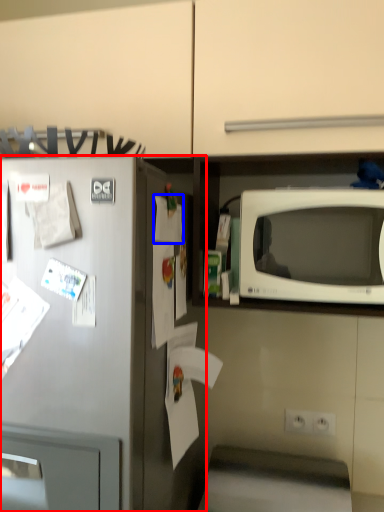
Question: Among these objects, which one is farthest to the camera, refrigerator (highlighted by a red box) or paper (highlighted by a blue box)?

Choices:
 (A) refrigerator
 (B) paper

Answer: (B)